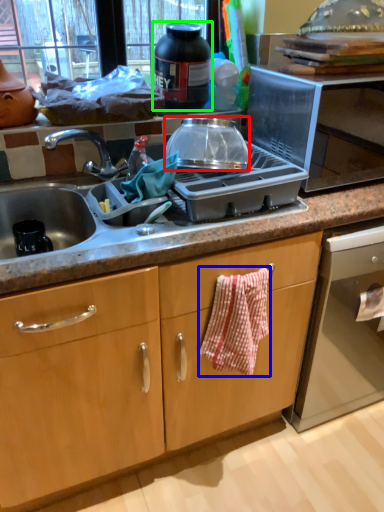
Question: Estimate the real-world distances between objects in this image. Which object is farther from kitchen appliance (highlighted by a red box), hand towel (highlighted by a blue box) or kitchen appliance (highlighted by a green box)?

Choices:
 (A) hand towel
 (B) kitchen appliance

Answer: (A)